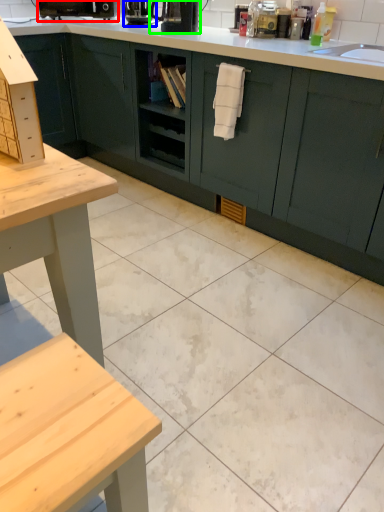
Question: Which object is positioned farthest from coffee machine (highlighted by a red box)? Select from coffee machine (highlighted by a blue box) and coffee machine (highlighted by a green box).

Choices:
 (A) coffee machine
 (B) coffee machine

Answer: (B)